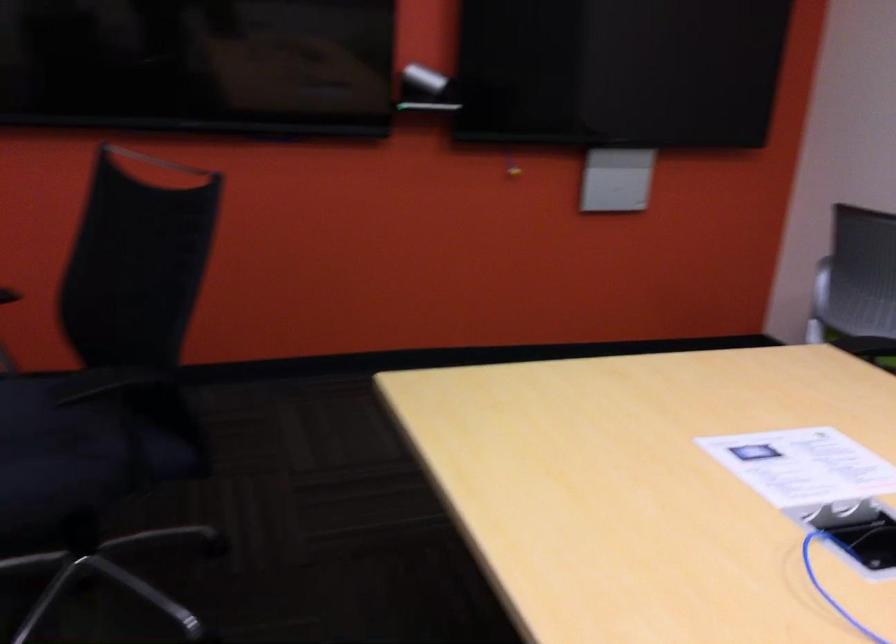
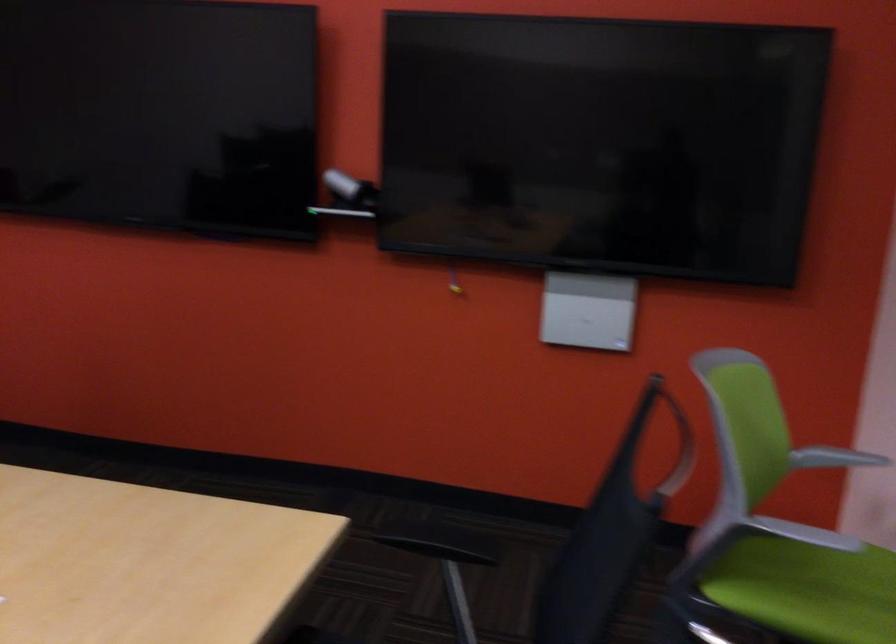
In a continuous first-person perspective shot, in which direction is the camera moving?

The cameraman walked toward right, forward.